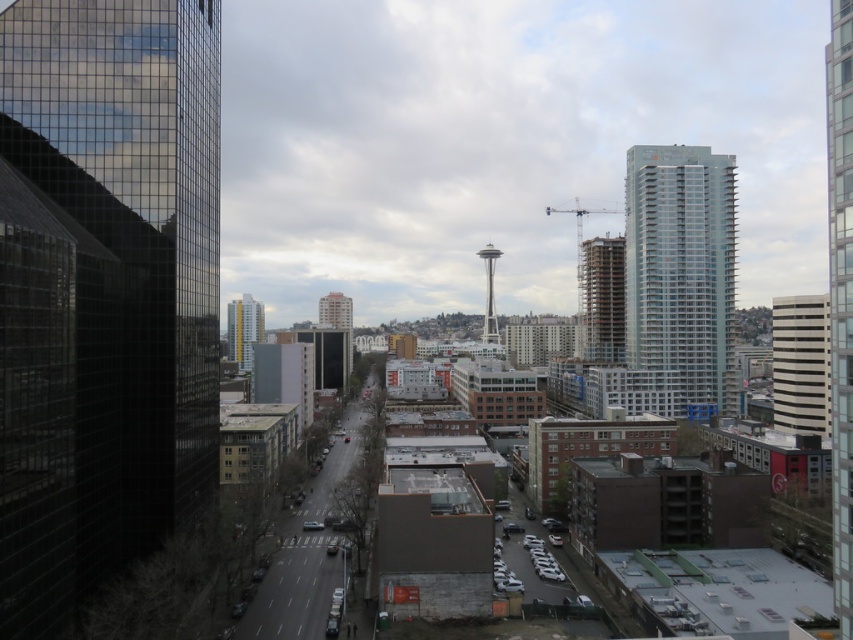
Is brown concrete building at center closer to camera compared to matte glass building at center?

Yes, it is.

Between brown concrete building at center and matte glass building at center, which one has less height?

With less height is matte glass building at center.

Find the location of a particular element. The image size is (853, 640). brown concrete building at center is located at coordinates (602, 300).

At what (x,y) coordinates should I click in order to perform the action: click on brown concrete building at center. Please return your answer as a coordinate pair (x, y). This screenshot has width=853, height=640. Looking at the image, I should click on (602, 300).

Measure the distance from glassy silver skyscraper at right to brown concrete building at center.

glassy silver skyscraper at right and brown concrete building at center are 125.11 feet apart.

Between glassy silver skyscraper at right and brown concrete building at center, which one is positioned higher?

glassy silver skyscraper at right is higher up.

Describe the element at coordinates (682, 269) in the screenshot. I see `glassy silver skyscraper at right` at that location.

Find the location of a particular element. This screenshot has width=853, height=640. glassy silver skyscraper at right is located at coordinates [682, 269].

Is glassy silver skyscraper at right positioned before glassy reflective skyscraper at right?

No, glassy silver skyscraper at right is further to the viewer.

Which is below, glassy silver skyscraper at right or glassy reflective skyscraper at right?

glassy reflective skyscraper at right is lower down.

Which is behind, point (706, 360) or point (850, 200)?

Point (706, 360)

What are the coordinates of `glassy silver skyscraper at right` in the screenshot? It's located at (682, 269).